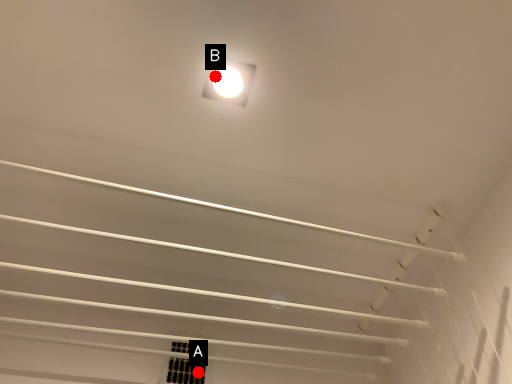
Question: Two points are circled on the image, labeled by A and B beside each circle. Which of the following is the farthest from the observer?

Choices:
 (A) A is further
 (B) B is further

Answer: (A)